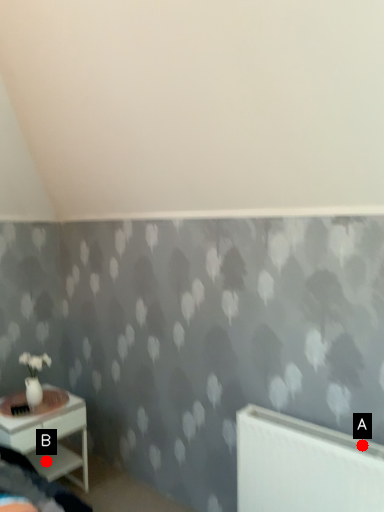
Question: Two points are circled on the image, labeled by A and B beside each circle. Which of the following is the farthest from the observer?

Choices:
 (A) A is further
 (B) B is further

Answer: (B)